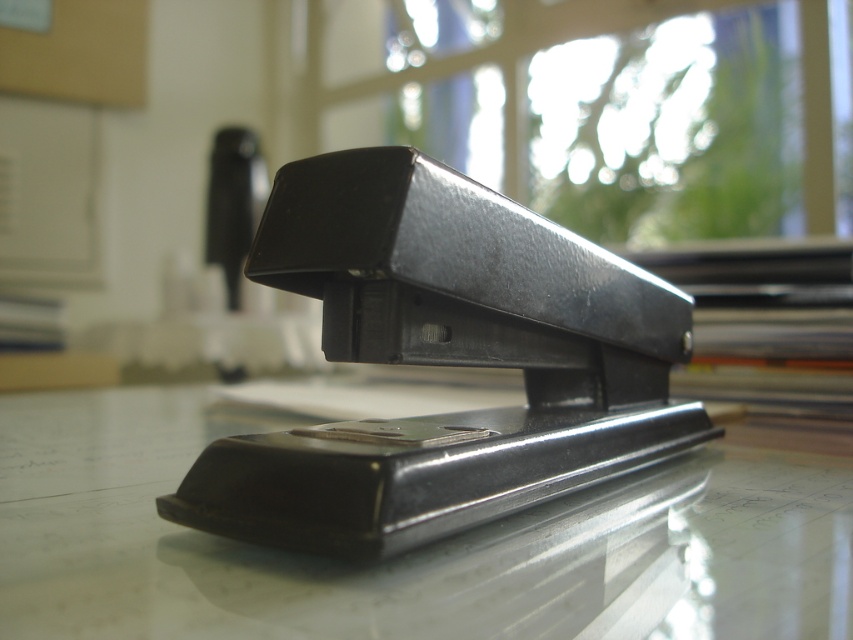
You are an office worker who needs to locate the black glossy stapler at center on your desk. According to the coordinates provided, where exactly is it positioned?

The black glossy stapler at center is located at point (405, 554).

You are trying to locate a specific point in an office scene. The coordinates given are point (405, 554). Based on the image description, which object is this point located on?

The point (405, 554) is on the black glossy stapler at center.

You are organizing your desk and notice two staplers at the center of your desk. Which one is closer to you, the black glossy stapler at center or the black plastic stapler at center?

→ The black glossy stapler at center is closer to you because it is in front of the black plastic stapler at center.